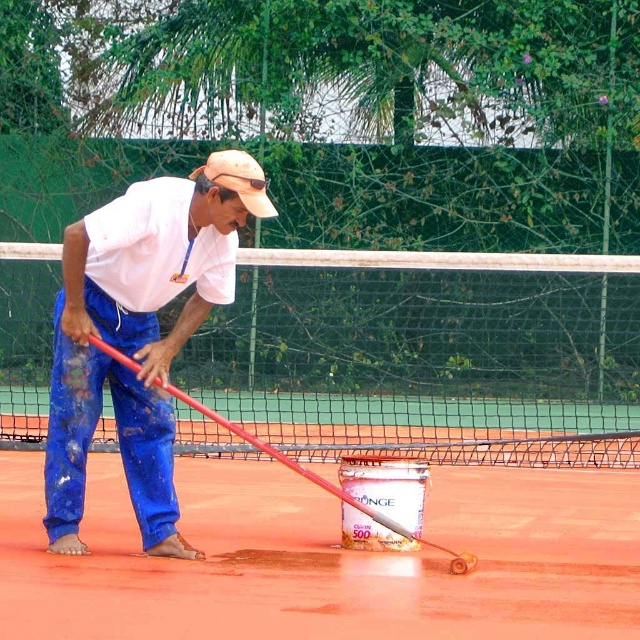
You are a tennis player observing the court from the baseline. Which object, the smooth clay surface at center or the blue cotton pants at center, is closer to the net?

The smooth clay surface at center is closer to the net than the blue cotton pants at center because the man is working on the court, and the pants are part of his clothing, likely positioned behind the surface he is applying material to.

You are a groundskeeper assessing the tennis court. You notice the white mesh tennis net at center and the tan fabric baseball cap at center. Which object is wider when viewed from above?

The white mesh tennis net at center is wider than the tan fabric baseball cap at center.

You are a spectator at the tennis court and want to see the man working on the court. Which object is closer to you between the white mesh tennis net at center and the tan fabric baseball cap at center?

The white mesh tennis net at center is closer to you because the tan fabric baseball cap at center is behind it.